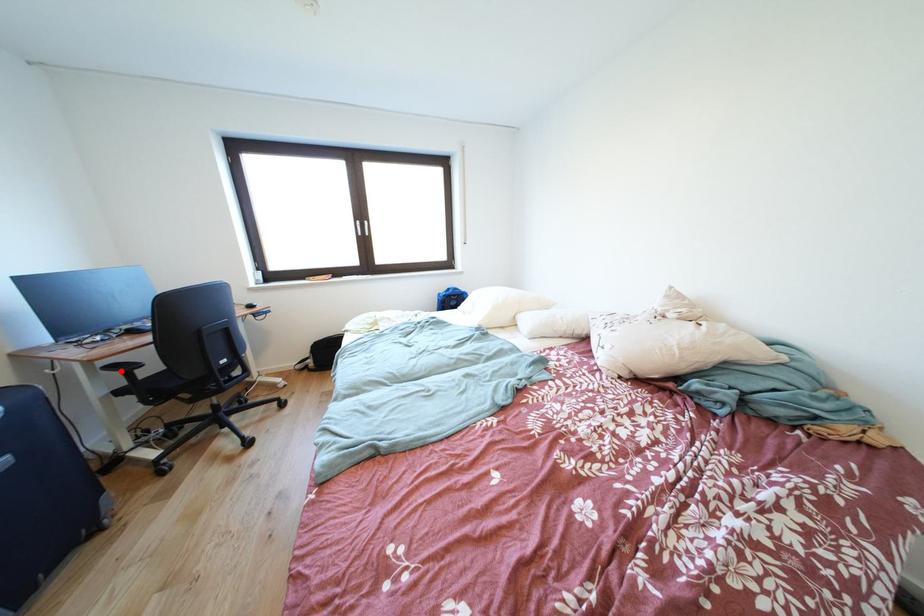
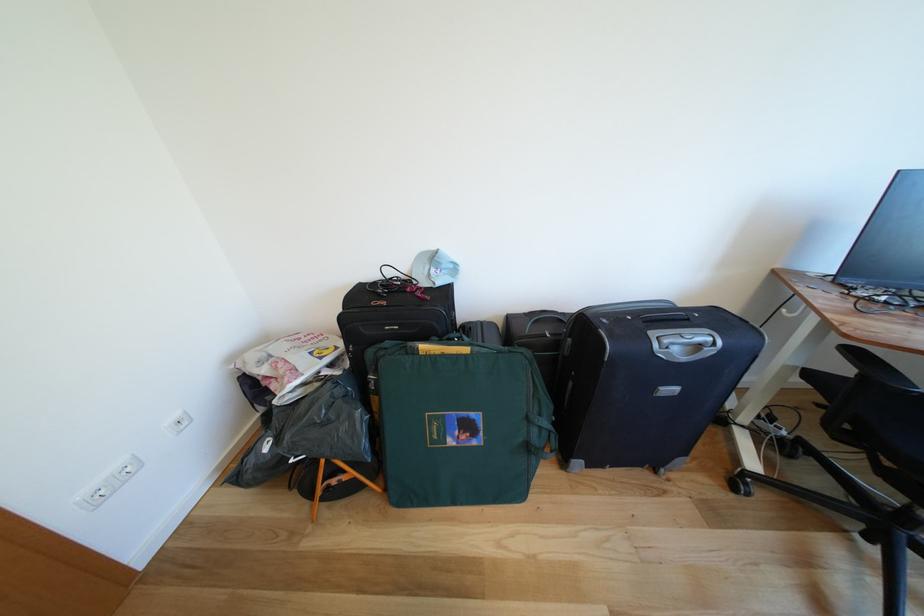
Find the pixel in the second image that matches the highlighted location in the first image.

(862, 357)